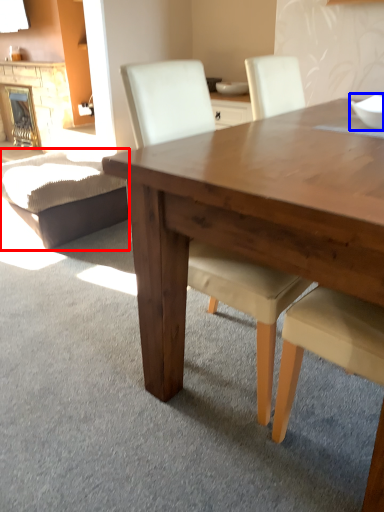
Question: Among these objects, which one is farthest to the camera, swivel chair (highlighted by a red box) or bowl (highlighted by a blue box)?

Choices:
 (A) swivel chair
 (B) bowl

Answer: (A)